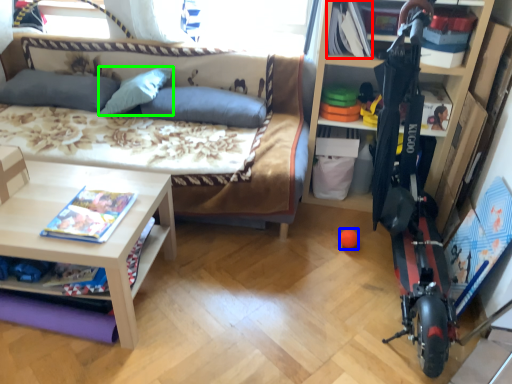
Question: Estimate the real-world distances between objects in this image. Which object is farther from book (highlighted by a red box), toy (highlighted by a blue box) or pillow (highlighted by a green box)?

Choices:
 (A) toy
 (B) pillow

Answer: (B)